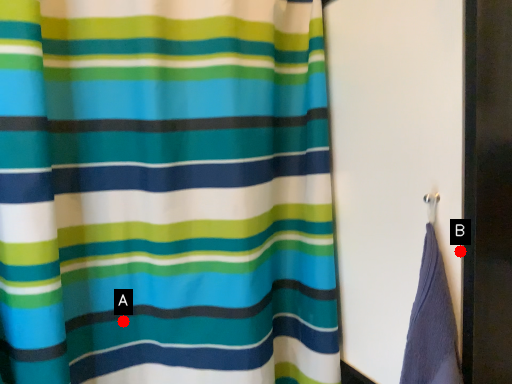
Question: Two points are circled on the image, labeled by A and B beside each circle. Which point is closer to the camera taking this photo?

Choices:
 (A) A is closer
 (B) B is closer

Answer: (B)